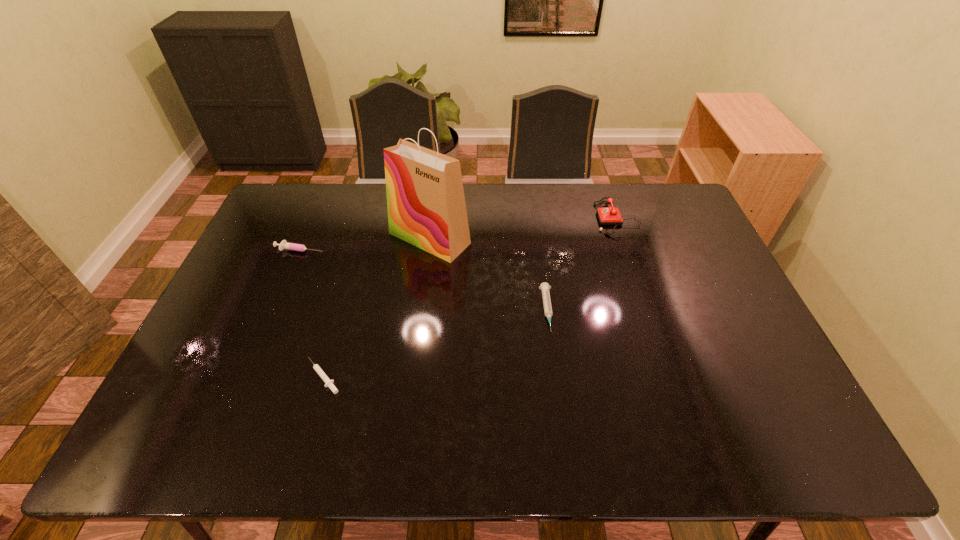
At what (x,y) coordinates should I click in order to perform the action: click on vacant area situated on the back of the third object from right to left. Please return your answer as a coordinate pair (x, y). Looking at the image, I should click on (435, 193).

Where is `vacant region located on the dial of the fourth shortest object`? vacant region located on the dial of the fourth shortest object is located at coordinates (515, 218).

You are a GUI agent. You are given a task and a screenshot of the screen. Output one action in this format:
    pyautogui.click(x=<x>, y=<y>)
    Task: Click on the free region located 0.340m on the dial of the fourth shortest object
    
    Given the screenshot: What is the action you would take?
    pyautogui.click(x=497, y=218)

The width and height of the screenshot is (960, 540). What are the coordinates of `vacant area situated on the dial of the fourth shortest object` in the screenshot? It's located at (572, 218).

Locate an element on the screen. free space located on the front of the leftmost object is located at coordinates (286, 285).

Identify the location of blank space located at the needle end of the rightmost syringe. This screenshot has width=960, height=540. (563, 423).

This screenshot has height=540, width=960. What are the coordinates of `vacant point located 0.190m on the right of the nearest object` in the screenshot? It's located at [420, 376].

Find the location of a particular element. shopping bag that is at the far edge is located at coordinates (426, 206).

Find the location of `telephone that is at the far edge`. telephone that is at the far edge is located at coordinates (611, 215).

You are a GUI agent. You are given a task and a screenshot of the screen. Output one action in this format:
    pyautogui.click(x=<x>, y=<y>)
    Task: Click on the object at the left edge
    
    Given the screenshot: What is the action you would take?
    pyautogui.click(x=284, y=244)